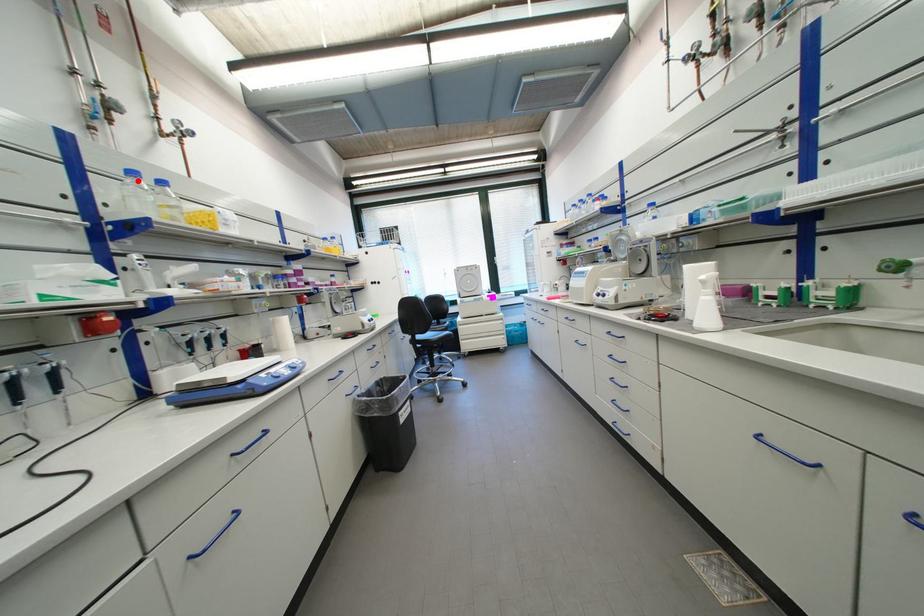
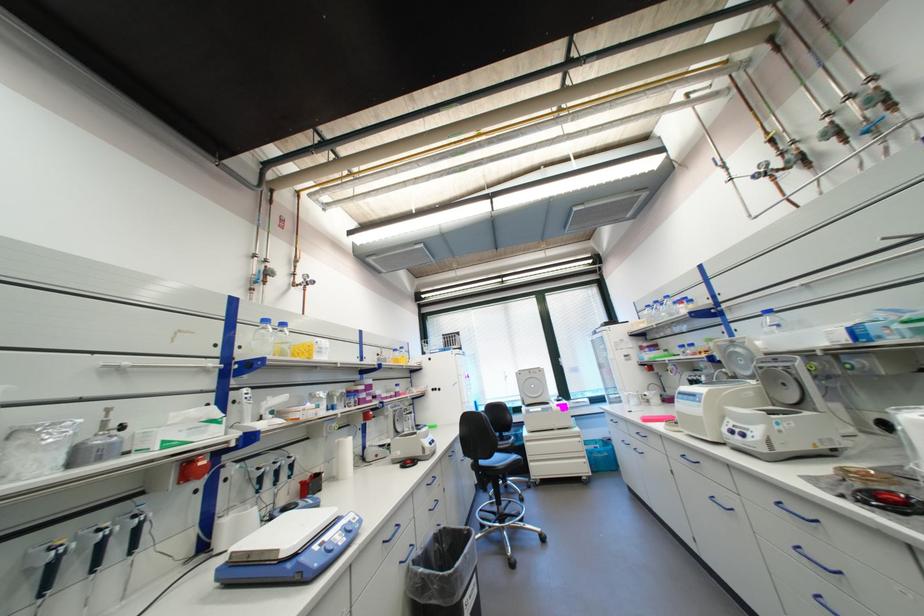
In the second image, find the point that corresponds to the highlighted location in the first image.

(271, 326)